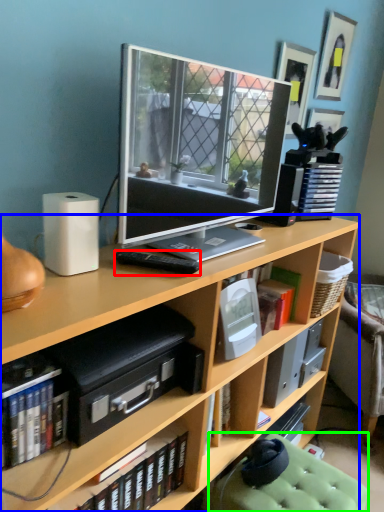
Question: Based on their relative distances, which object is nearer to remote control (highlighted by a red box)? Choose from bookcase (highlighted by a blue box) and swivel chair (highlighted by a green box).

Choices:
 (A) bookcase
 (B) swivel chair

Answer: (A)